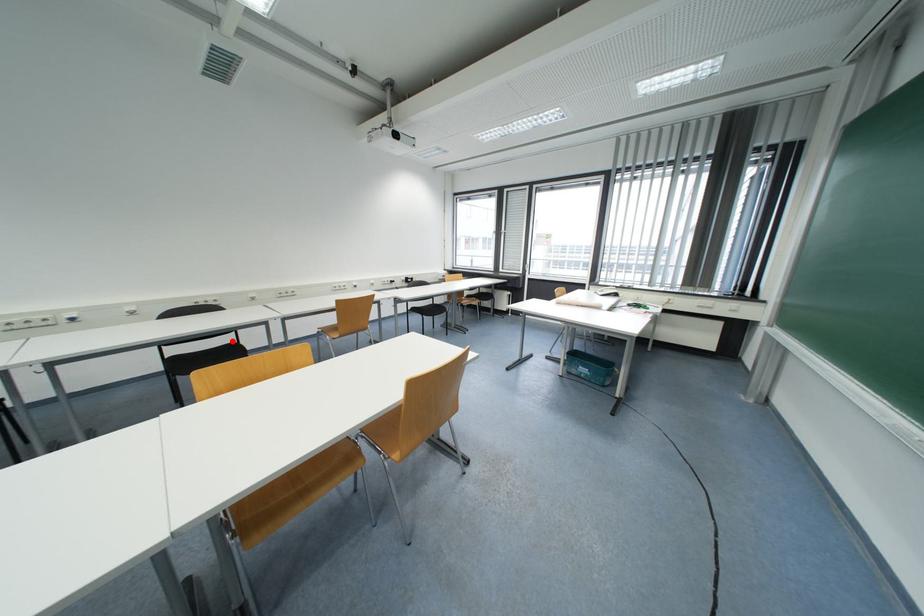
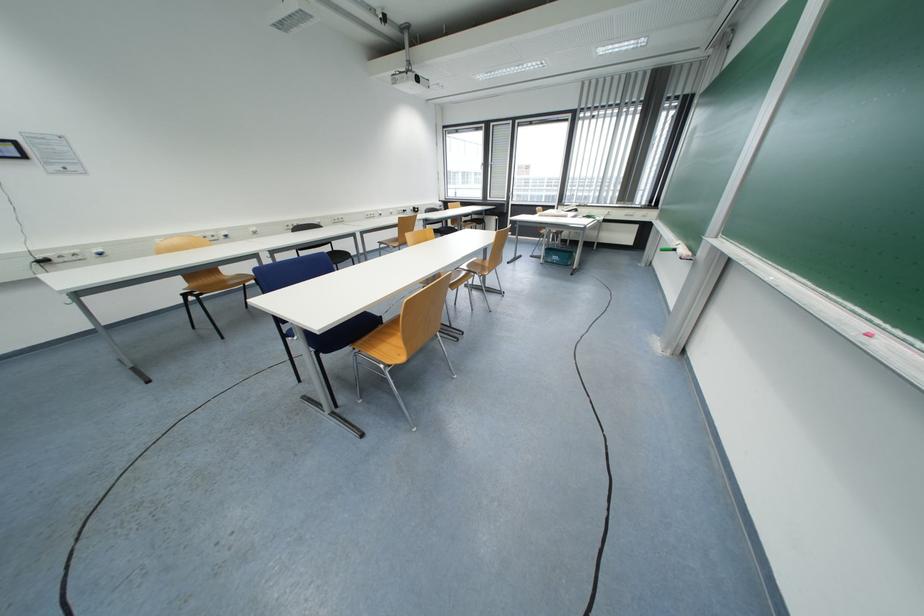
Question: A red point is marked in image1. In image2, is the corresponding 3D point closer to the camera or farther? Reply with the corresponding letter.

Choices:
 (A) The corresponding 3D point is closer.
 (B) The corresponding 3D point is farther.

Answer: (A)